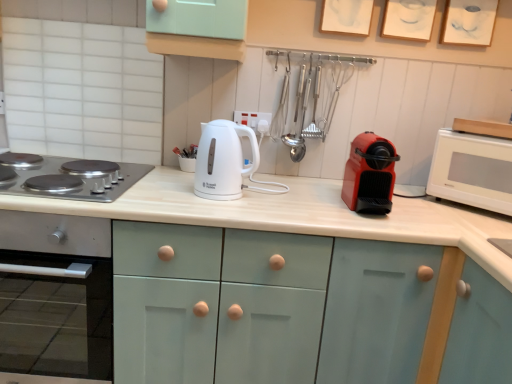
Question: From the image's perspective, is red matte coffee machine at right, which is the 2th kitchen appliance from left to right, located above or below white glossy electric kettle at center, which appears as the 2th kitchen appliance when viewed from the right?

Choices:
 (A) above
 (B) below

Answer: (B)

Question: Considering the positions of red matte coffee machine at right, which is the 2th kitchen appliance from left to right, and white glossy electric kettle at center, acting as the 1th kitchen appliance starting from the left, in the image, is red matte coffee machine at right, which is the 2th kitchen appliance from left to right, wider or thinner than white glossy electric kettle at center, acting as the 1th kitchen appliance starting from the left,?

Choices:
 (A) thin
 (B) wide

Answer: (B)

Question: Estimate the real-world distances between objects in this image. Which object is farther from the white matte countertop at center?

Choices:
 (A) red matte coffee machine at right, the 1th kitchen appliance from the right
 (B) white glossy microwave at right
 (C) white glossy electric kettle at center, which appears as the 2th kitchen appliance when viewed from the right
 (D) stainless steel gas stove at left

Answer: (D)

Question: Estimate the real-world distances between objects in this image. Which object is closer to the white matte countertop at center?

Choices:
 (A) white glossy microwave at right
 (B) red matte coffee machine at right, the 1th kitchen appliance from the right
 (C) white glossy electric kettle at center, acting as the 1th kitchen appliance starting from the left
 (D) stainless steel gas stove at left

Answer: (B)